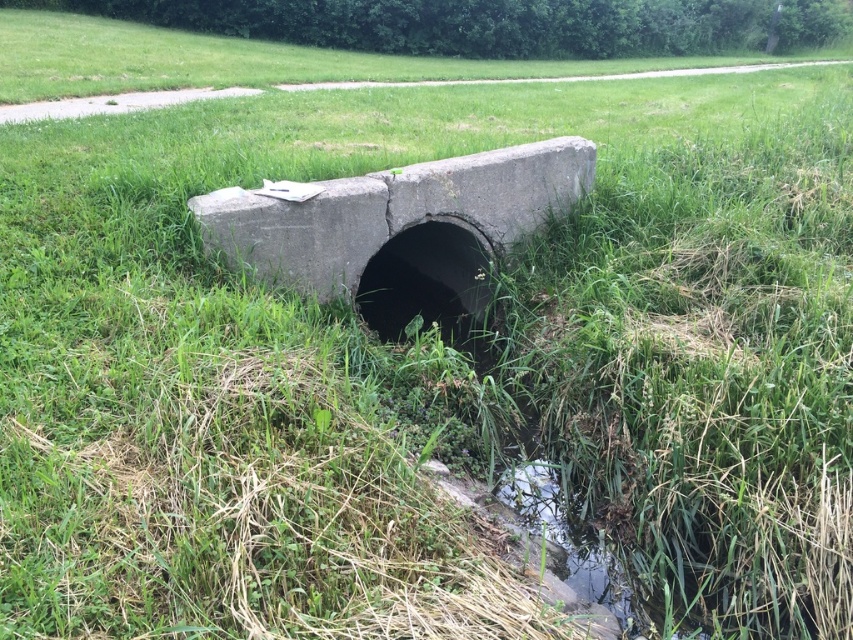
Can you confirm if gray concrete culvert at center is thinner than concrete pipe at center?

In fact, gray concrete culvert at center might be wider than concrete pipe at center.

Does gray concrete culvert at center have a larger size compared to concrete pipe at center?

Indeed, gray concrete culvert at center has a larger size compared to concrete pipe at center.

The width and height of the screenshot is (853, 640). What do you see at coordinates (393, 211) in the screenshot?
I see `gray concrete culvert at center` at bounding box center [393, 211].

What are the coordinates of `gray concrete culvert at center` in the screenshot? It's located at (393, 211).